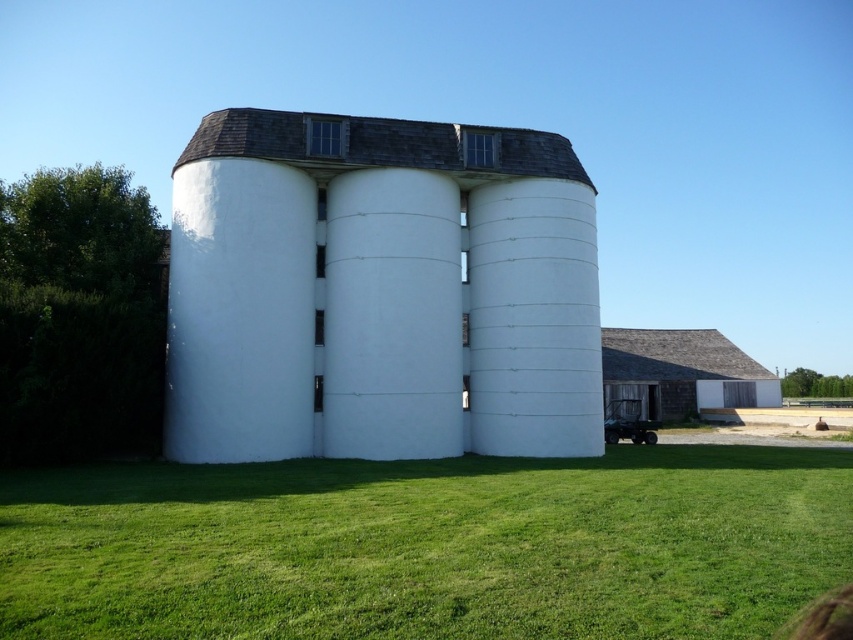
Can you confirm if green grass at center is positioned to the left of white smooth silo at center?

No, green grass at center is not to the left of white smooth silo at center.

Which is in front, point (704, 452) or point (387, 273)?

Point (387, 273) is more forward.

Locate an element on the screen. green grass at center is located at coordinates (427, 545).